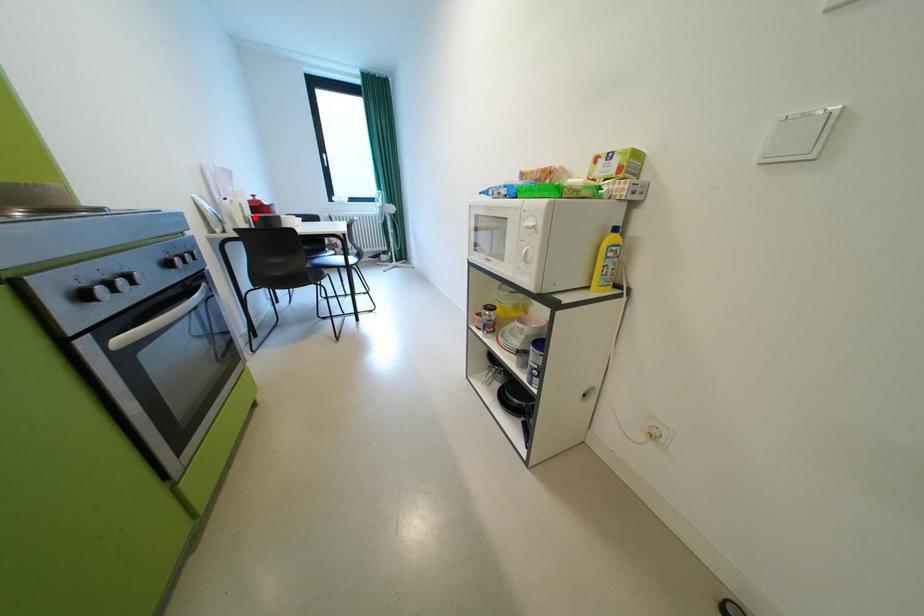
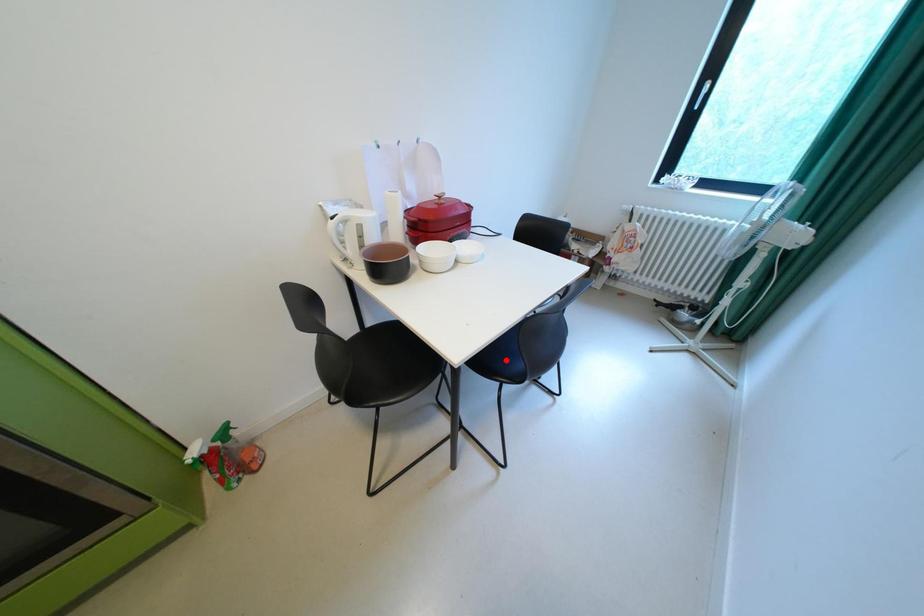
I am providing you with two images of the same scene from different viewpoints. A red point is marked on the first image and another point is marked on the second image. Is the marked point in image1 the same physical position as the marked point in image2?

No